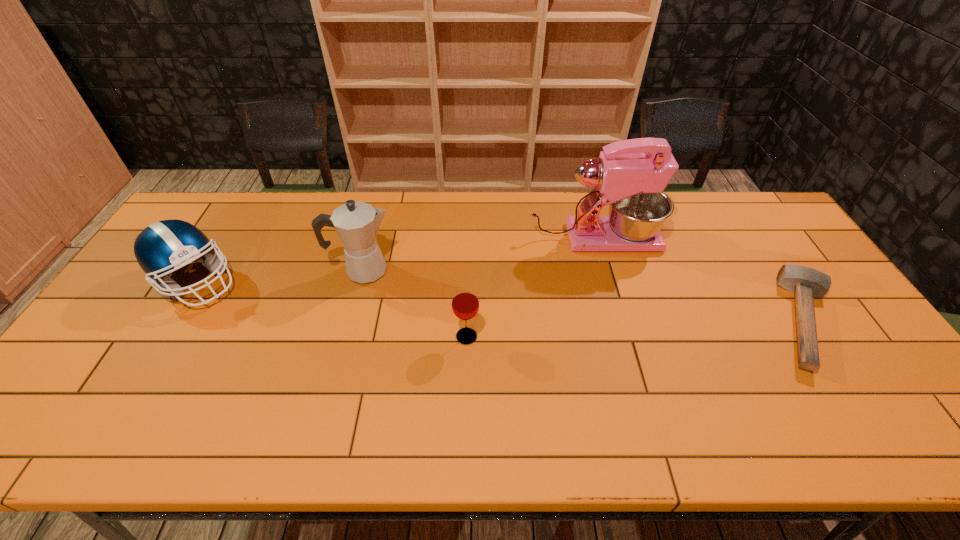
The width and height of the screenshot is (960, 540). What are the coordinates of `vacant space that's between the third object from left to right and the mallet` in the screenshot? It's located at (636, 328).

Find the location of a particular element. unoccupied position between the football helmet and the third object from left to right is located at coordinates (332, 309).

Find the location of a particular element. Image resolution: width=960 pixels, height=540 pixels. free space between the fourth object from left to right and the football helmet is located at coordinates (396, 260).

This screenshot has width=960, height=540. In order to click on vacant space that is in between the football helmet and the second object from left to right in this screenshot , I will do `click(280, 276)`.

The image size is (960, 540). Find the location of `vacant area between the glass and the rightmost object`. vacant area between the glass and the rightmost object is located at coordinates (636, 328).

The height and width of the screenshot is (540, 960). I want to click on free spot between the fourth shortest object and the glass, so click(415, 303).

Identify the location of vacant point located between the glass and the second tallest object. This screenshot has width=960, height=540. (415, 303).

This screenshot has height=540, width=960. In order to click on vacant space in between the mixer and the fourth object from right to left in this screenshot , I will do `click(479, 254)`.

The width and height of the screenshot is (960, 540). I want to click on vacant point located between the football helmet and the tallest object, so click(x=396, y=260).

The width and height of the screenshot is (960, 540). I want to click on empty location between the mallet and the fourth object from left to right, so click(x=700, y=279).